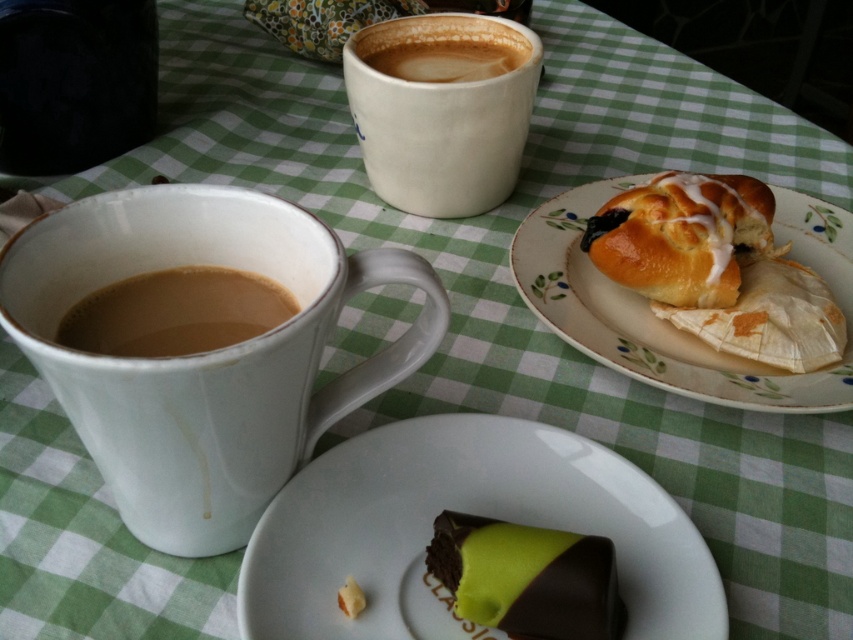
Which is in front, point (469, 528) or point (480, 22)?

Point (469, 528) is in front.

Does chocolate-coated green cake at lower center lie in front of cappuccino foam at upper center?

Yes, it is in front of cappuccino foam at upper center.

Between point (442, 582) and point (431, 20), which one is positioned in front?

Point (442, 582) is more forward.

What are the coordinates of `chocolate-coated green cake at lower center` in the screenshot? It's located at [x=527, y=577].

Which is behind, point (721, 371) or point (587, 579)?

The point (721, 371) is more distant.

The width and height of the screenshot is (853, 640). I want to click on matte ceramic plate at upper right, so click(x=668, y=323).

Is matte ceramic plate at upper right wider than brown matte cup at left?

Yes.

Which is in front, point (830, 232) or point (277, 308)?

Positioned in front is point (277, 308).

Image resolution: width=853 pixels, height=640 pixels. Identify the location of matte ceramic plate at upper right. (668, 323).